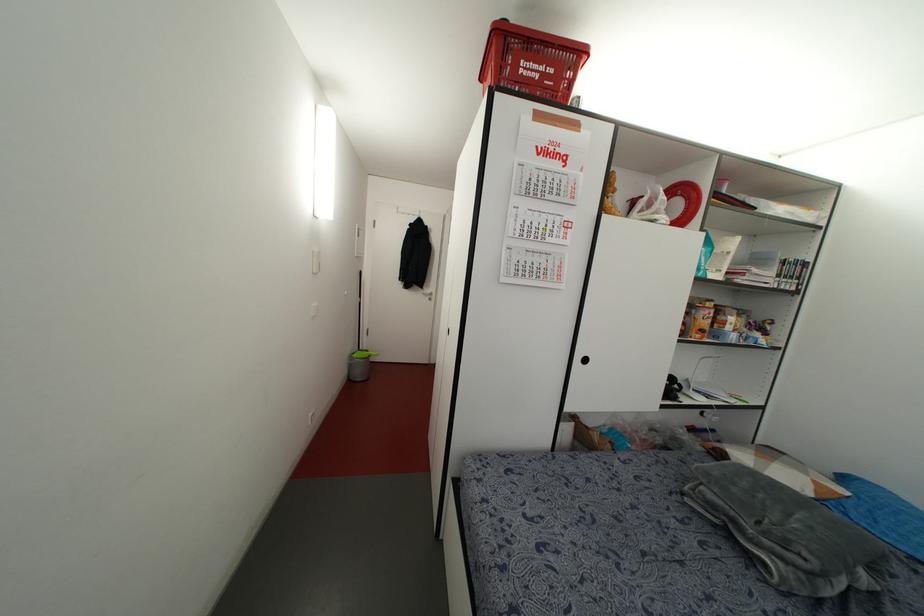
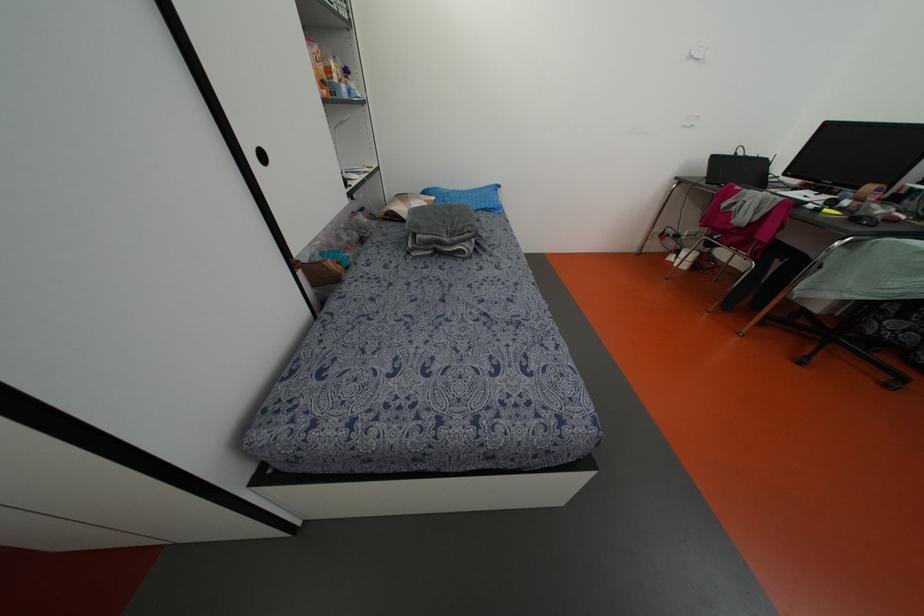
Locate, in the second image, the point that corresponds to (x=585, y=360) in the first image.

(262, 156)